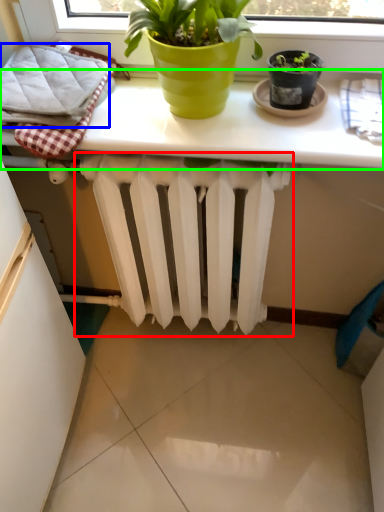
Question: Which object is positioned closest to radiator (highlighted by a red box)? Select from bath towel (highlighted by a blue box) and table (highlighted by a green box).

Choices:
 (A) bath towel
 (B) table

Answer: (B)